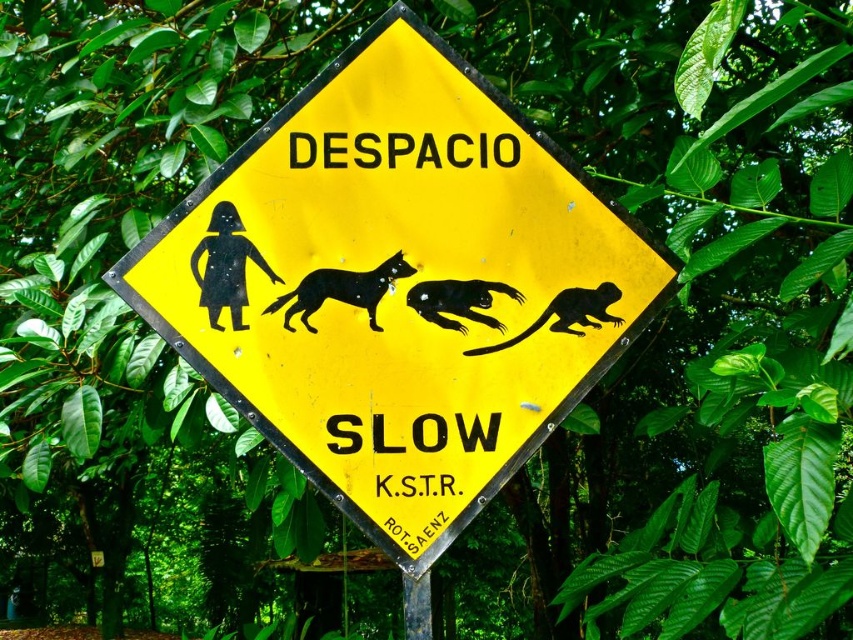
Question: Can you confirm if black glossy dog at center is smaller than black rubber monkey at center?

Choices:
 (A) yes
 (B) no

Answer: (B)

Question: Is black glossy dog at center further to the viewer compared to silhouette glossy monkey at center?

Choices:
 (A) no
 (B) yes

Answer: (A)

Question: Which object is the closest to the black glossy dog at center?

Choices:
 (A) silhouette glossy monkey at center
 (B) metallic gray pole at lower center

Answer: (A)

Question: Which object is the farthest from the metallic gray pole at lower center?

Choices:
 (A) yellow plastic sign at center
 (B) black rubber monkey at center
 (C) silhouette glossy monkey at center

Answer: (A)

Question: Does black rubber monkey at center appear over metallic gray pole at lower center?

Choices:
 (A) no
 (B) yes

Answer: (B)

Question: Estimate the real-world distances between objects in this image. Which object is farther from the black glossy dog at center?

Choices:
 (A) metallic gray pole at lower center
 (B) black rubber monkey at center

Answer: (A)